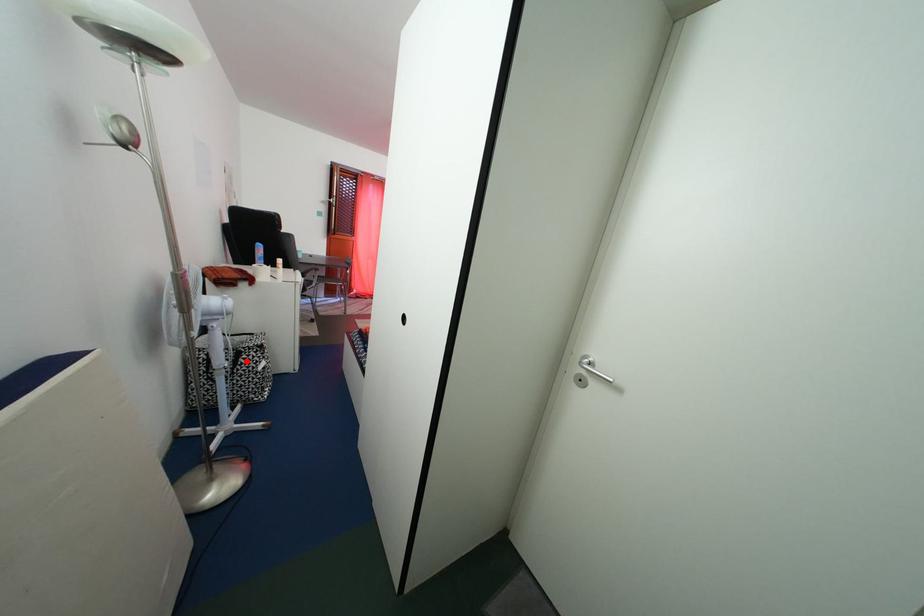
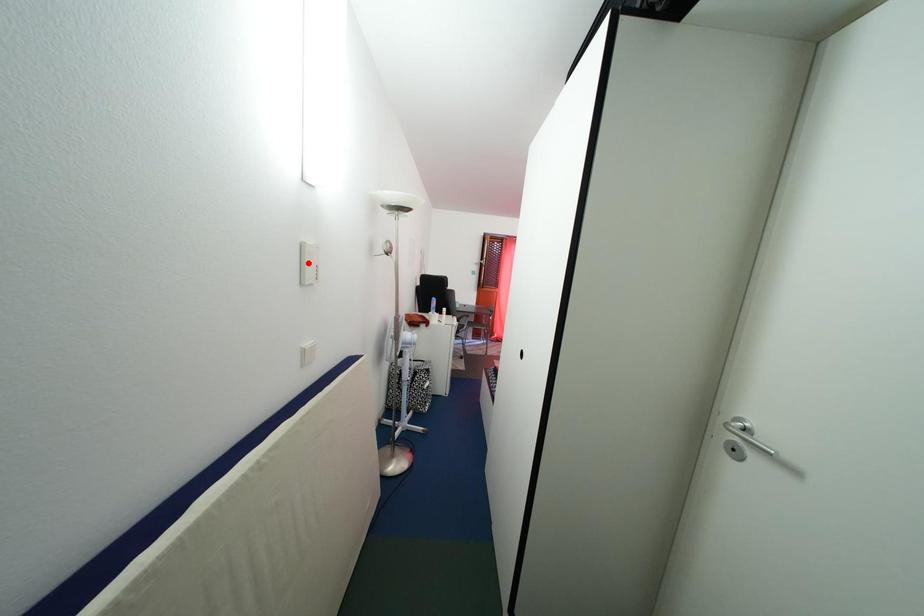
I am providing you with two images of the same scene from different viewpoints. A red point is marked on the first image and another point is marked on the second image. Is the red point in image1 aligned with the point shown in image2?

No